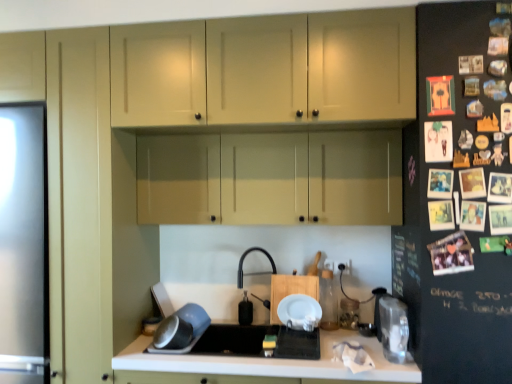
Describe the element at coordinates (394, 328) in the screenshot. I see `transparent plastic container at right, which is the third appliance from left to right` at that location.

Where is `transparent plastic container at right, which is the third appliance from left to right`? transparent plastic container at right, which is the third appliance from left to right is located at coordinates (394, 328).

I want to click on black matte fridge at right, so click(458, 197).

What do you see at coordinates (253, 273) in the screenshot? The image size is (512, 384). I see `black rubber faucet at center` at bounding box center [253, 273].

This screenshot has height=384, width=512. What do you see at coordinates (266, 71) in the screenshot? I see `matte cream cabinets at upper center, which is counted as the 2th cabinetry, starting from the bottom` at bounding box center [266, 71].

At what (x,y) coordinates should I click in order to perform the action: click on transparent plastic container at right, the 1th appliance from the right. Please return your answer as a coordinate pair (x, y). This screenshot has width=512, height=384. Looking at the image, I should click on (394, 328).

Does matte cream cabinets at upper center, which is counted as the 2th cabinetry, starting from the bottom, have a greater width compared to transparent plastic container at right, the 1th appliance from the right?

Correct, the width of matte cream cabinets at upper center, which is counted as the 2th cabinetry, starting from the bottom, exceeds that of transparent plastic container at right, the 1th appliance from the right.

Is matte cream cabinets at upper center, acting as the first cabinetry starting from the top, oriented away from transparent plastic container at right, which is the third appliance from left to right?

No, matte cream cabinets at upper center, acting as the first cabinetry starting from the top, is not facing the opposite direction of transparent plastic container at right, which is the third appliance from left to right.

Considering the relative sizes of matte cream cabinets at upper center, acting as the first cabinetry starting from the top, and transparent plastic container at right, which is the third appliance from left to right, in the image provided, is matte cream cabinets at upper center, acting as the first cabinetry starting from the top, shorter than transparent plastic container at right, which is the third appliance from left to right,?

No, matte cream cabinets at upper center, acting as the first cabinetry starting from the top, is not shorter than transparent plastic container at right, which is the third appliance from left to right.

Considering the sizes of objects metallic silver bowl at lower left, placed as the first appliance when sorted from left to right, and black matte sink at center in the image provided, who is thinner, metallic silver bowl at lower left, placed as the first appliance when sorted from left to right, or black matte sink at center?

metallic silver bowl at lower left, placed as the first appliance when sorted from left to right, is thinner.

Is point (180, 334) closer to viewer compared to point (232, 329)?

Yes.

Is metallic silver bowl at lower left, placed as the first appliance when sorted from left to right, located outside black matte sink at center?

No, metallic silver bowl at lower left, placed as the first appliance when sorted from left to right, is inside black matte sink at center's boundary.

Are metallic silver bowl at lower left, placed as the first appliance when sorted from left to right, and black matte sink at center located far from each other?

They are positioned close to each other.

Consider the image. Is transparent plastic container at right, which is the third appliance from left to right, at the left side of matte beige cabinets at center, the 1th cabinetry positioned from the bottom?

No, transparent plastic container at right, which is the third appliance from left to right, is not to the left of matte beige cabinets at center, the 1th cabinetry positioned from the bottom.

From the picture: Does transparent plastic container at right, which is the third appliance from left to right, touch matte beige cabinets at center, the 1th cabinetry positioned from the bottom?

transparent plastic container at right, which is the third appliance from left to right, is not next to matte beige cabinets at center, the 1th cabinetry positioned from the bottom, and they're not touching.

Would you say transparent plastic container at right, which is the third appliance from left to right, contains matte beige cabinets at center, acting as the 2th cabinetry starting from the top?

No, matte beige cabinets at center, acting as the 2th cabinetry starting from the top, is not inside transparent plastic container at right, which is the third appliance from left to right.

Does transparent plastic container at right, the 1th appliance from the right, have a greater width compared to matte beige cabinets at center, acting as the 2th cabinetry starting from the top?

No, transparent plastic container at right, the 1th appliance from the right, is not wider than matte beige cabinets at center, acting as the 2th cabinetry starting from the top.

Is matte beige cabinets at center, acting as the 2th cabinetry starting from the top, far from translucent plastic container at center, arranged as the second appliance when viewed from the left?

They are positioned close to each other.

Does matte beige cabinets at center, acting as the 2th cabinetry starting from the top, turn towards translucent plastic container at center, arranged as the second appliance when viewed from the left?

No, matte beige cabinets at center, acting as the 2th cabinetry starting from the top, is not aimed at translucent plastic container at center, arranged as the second appliance when viewed from the left.

From the image's perspective, is matte beige cabinets at center, acting as the 2th cabinetry starting from the top, above translucent plastic container at center, arranged as the second appliance when viewed from the left?

Indeed, from the image's perspective, matte beige cabinets at center, acting as the 2th cabinetry starting from the top, is shown above translucent plastic container at center, arranged as the second appliance when viewed from the left.

You are a GUI agent. You are given a task and a screenshot of the screen. Output one action in this format:
    pyautogui.click(x=<x>, y=<y>)
    Task: Click on the 2nd appliance below the matte beige cabinets at center, the 1th cabinetry positioned from the bottom (from the image's perspective)
    Image resolution: width=512 pixels, height=384 pixels.
    Given the screenshot: What is the action you would take?
    pyautogui.click(x=349, y=313)

Which of these two, black matte sink at center or metallic silver bowl at lower left, which is the 3th appliance from right to left, stands shorter?

metallic silver bowl at lower left, which is the 3th appliance from right to left, is shorter.

Which is more to the right, black matte sink at center or metallic silver bowl at lower left, placed as the first appliance when sorted from left to right?

black matte sink at center is more to the right.

Considering the positions of point (319, 350) and point (189, 303), is point (319, 350) closer or farther from the camera than point (189, 303)?

Point (319, 350) is closer to the camera than point (189, 303).

How much distance is there between black matte sink at center and metallic silver bowl at lower left, placed as the first appliance when sorted from left to right?

A distance of 8.63 inches exists between black matte sink at center and metallic silver bowl at lower left, placed as the first appliance when sorted from left to right.

Image resolution: width=512 pixels, height=384 pixels. I want to click on the 1st appliance directly beneath the black matte fridge at right (from a real-world perspective), so click(394, 328).

Is black matte fridge at right positioned far away from transparent plastic container at right, which is the third appliance from left to right?

No, black matte fridge at right is not far away from transparent plastic container at right, which is the third appliance from left to right.

In the image, is black matte fridge at right on the left side or the right side of transparent plastic container at right, which is the third appliance from left to right?

From the image, it's evident that black matte fridge at right is to the right of transparent plastic container at right, which is the third appliance from left to right.

Looking at this image, is black matte fridge at right not close to black rubber faucet at center?

Absolutely, black matte fridge at right is distant from black rubber faucet at center.

Could you tell me if black matte fridge at right is turned towards black rubber faucet at center?

No, black matte fridge at right does not turn towards black rubber faucet at center.

Considering the relative sizes of black matte fridge at right and black rubber faucet at center in the image provided, is black matte fridge at right thinner than black rubber faucet at center?

Incorrect, the width of black matte fridge at right is not less than that of black rubber faucet at center.

Is black matte fridge at right located outside black rubber faucet at center?

Absolutely, black matte fridge at right is external to black rubber faucet at center.

Find the location of a particular element. Image resolution: width=512 pixels, height=384 pixels. the 2nd cabinetry positioned above the transparent plastic container at right, which is the third appliance from left to right (from the image's perspective) is located at coordinates (266, 71).

You are a GUI agent. You are given a task and a screenshot of the screen. Output one action in this format:
    pyautogui.click(x=<x>, y=<y>)
    Task: Click on the sink on the right of the metallic silver bowl at lower left, placed as the first appliance when sorted from left to right
    
    Given the screenshot: What is the action you would take?
    pyautogui.click(x=257, y=341)

From the image, which object appears to be farther from white matte countertop at center, matte beige cabinets at center, the 1th cabinetry positioned from the bottom, or matte cream cabinets at upper center, which is counted as the 2th cabinetry, starting from the bottom?

matte cream cabinets at upper center, which is counted as the 2th cabinetry, starting from the bottom, lies further to white matte countertop at center than the other object.

Estimate the real-world distances between objects in this image. Which object is further from transparent plastic container at right, the 1th appliance from the right, black rubber faucet at center or black matte sink at center?

black rubber faucet at center.

Based on their spatial positions, is metallic silver bowl at lower left, which is the 3th appliance from right to left, or translucent plastic container at center, marked as the 2th appliance in a right-to-left arrangement, closer to matte beige cabinets at center, acting as the 2th cabinetry starting from the top?

Based on the image, metallic silver bowl at lower left, which is the 3th appliance from right to left, appears to be nearer to matte beige cabinets at center, acting as the 2th cabinetry starting from the top.

Based on their spatial positions, is black matte sink at center or translucent plastic container at center, marked as the 2th appliance in a right-to-left arrangement, further from black rubber faucet at center?

translucent plastic container at center, marked as the 2th appliance in a right-to-left arrangement, lies further to black rubber faucet at center than the other object.

Which object lies nearer to the anchor point metallic silver bowl at lower left, which is the 3th appliance from right to left, black matte sink at center or black matte fridge at right?

Based on the image, black matte sink at center appears to be nearer to metallic silver bowl at lower left, which is the 3th appliance from right to left.

Which object lies further to the anchor point matte cream cabinets at upper center, which is counted as the 2th cabinetry, starting from the bottom, black matte fridge at right or matte beige cabinets at center, acting as the 2th cabinetry starting from the top?

Among the two, black matte fridge at right is located further to matte cream cabinets at upper center, which is counted as the 2th cabinetry, starting from the bottom.

Considering their positions, is translucent plastic container at center, arranged as the second appliance when viewed from the left, positioned closer to black rubber faucet at center than black matte sink at center?

Among the two, black matte sink at center is located nearer to black rubber faucet at center.

From the image, which object appears to be nearer to black matte sink at center, translucent plastic container at center, marked as the 2th appliance in a right-to-left arrangement, or white matte countertop at center?

white matte countertop at center is closer to black matte sink at center.

I want to click on cabinetry between matte cream cabinets at upper center, acting as the first cabinetry starting from the top, and translucent plastic container at center, marked as the 2th appliance in a right-to-left arrangement, in the up-down direction, so click(271, 178).

Image resolution: width=512 pixels, height=384 pixels. In order to click on faucet situated between black matte sink at center and transparent plastic container at right, which is the third appliance from left to right, from left to right in this screenshot , I will do `click(253, 273)`.

This screenshot has width=512, height=384. Identify the location of cabinetry between matte cream cabinets at upper center, which is counted as the 2th cabinetry, starting from the bottom, and white matte countertop at center, in the vertical direction. (271, 178).

I want to click on faucet located between metallic silver bowl at lower left, placed as the first appliance when sorted from left to right, and translucent plastic container at center, marked as the 2th appliance in a right-to-left arrangement, in the left-right direction, so click(253, 273).